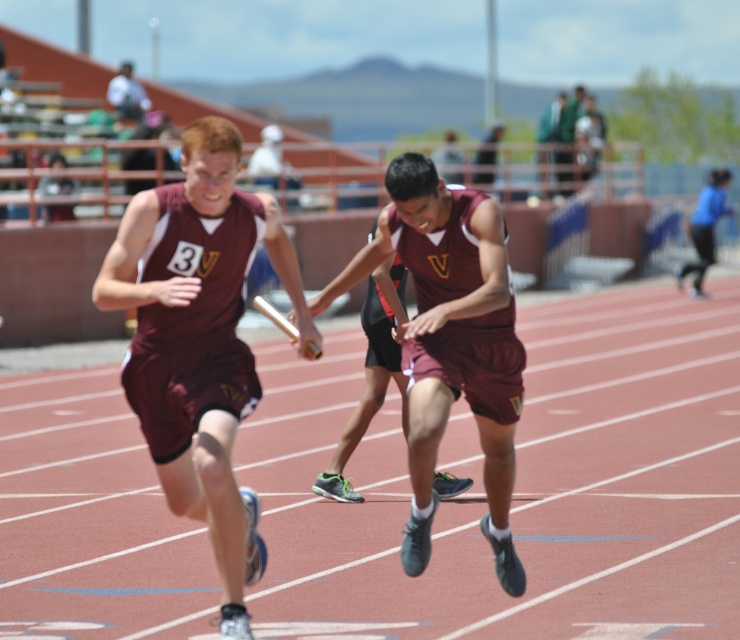
You are a photographer at the track and field event. You need to capture a photo that clearly shows the number on the maroon jersey at center and the logo on the maroon fabric uniform at center. Which one of these items will appear smaller in the photo?

The maroon jersey at center will appear smaller in the photo because it has a lesser width compared to the maroon fabric uniform at center.

Based on the scene description, which athlete is positioned lower in the image, the maroon fabric uniform at center or the blue fabric runner at right?

The maroon fabric uniform at center is positioned lower in the image than the blue fabric runner at right according to the description.